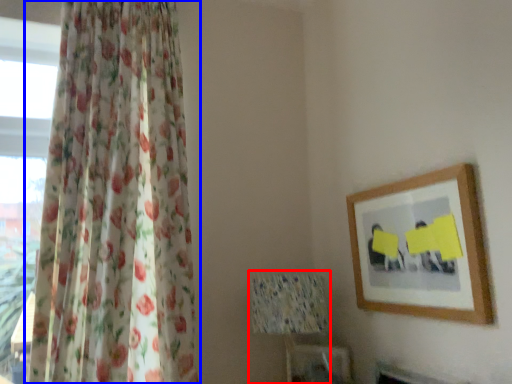
Question: Which point is further to the camera, table lamp (highlighted by a red box) or curtain (highlighted by a blue box)?

Choices:
 (A) table lamp
 (B) curtain

Answer: (A)